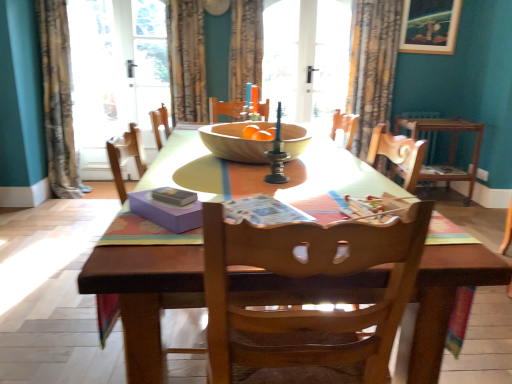
Where is `free location above printed paper magazine at center, arranged as the second magazine when viewed from the left (from a real-world perspective)`? free location above printed paper magazine at center, arranged as the second magazine when viewed from the left (from a real-world perspective) is located at coordinates (273, 210).